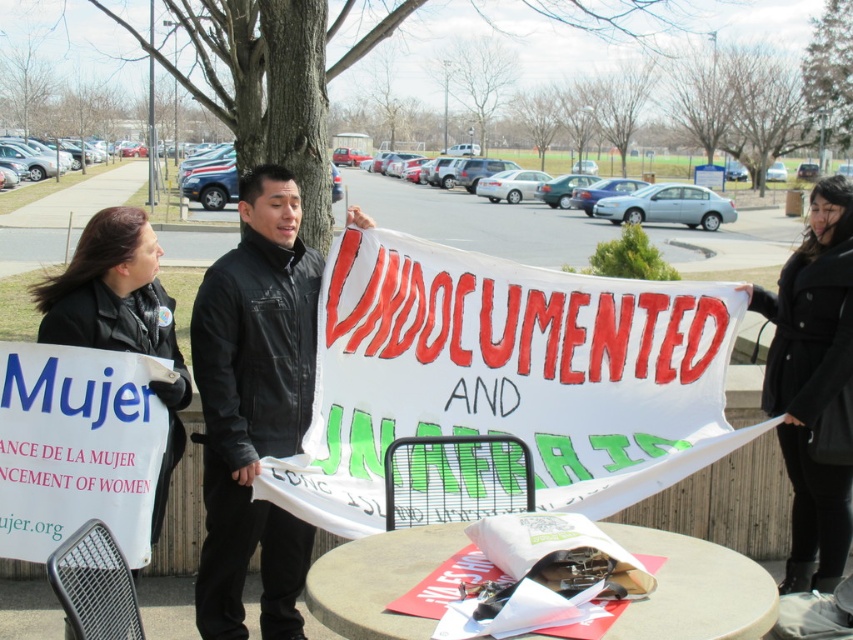
You are a photographer at the protest scene. You want to take a photo that includes both the black leather jacket at center and the black leather jacket at left. Since you want to capture their full height, which jacket should you focus on to ensure both are fully visible?

The black leather jacket at center is much taller than the black leather jacket at left, so focusing on the taller one ensures both are fully visible in the photo.

You are a photographer trying to capture a photo of the protest. You want to ensure both the black wool coat at right and the black leather jacket at left are visible in the frame. Considering their heights, which one is more likely to block the view of the other?

Result: The black wool coat at right is taller than the black leather jacket at left, so it is more likely to block the view of the black leather jacket at left.